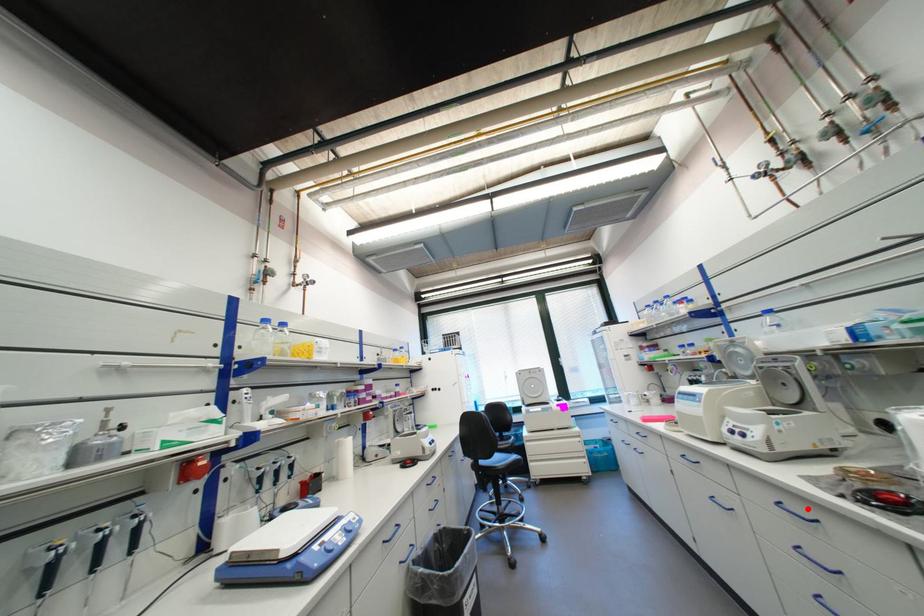
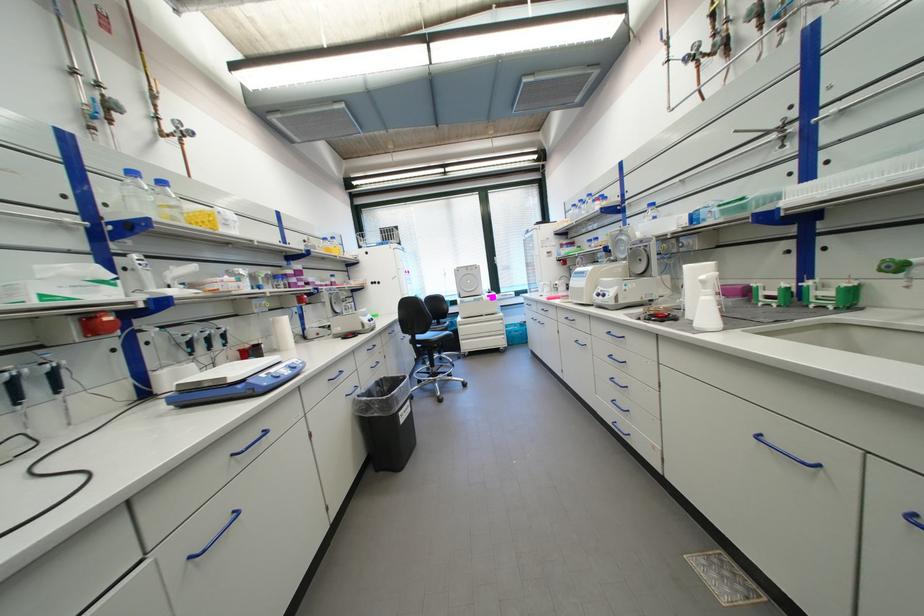
In the second image, find the point that corresponds to the highlighted location in the first image.

(625, 333)